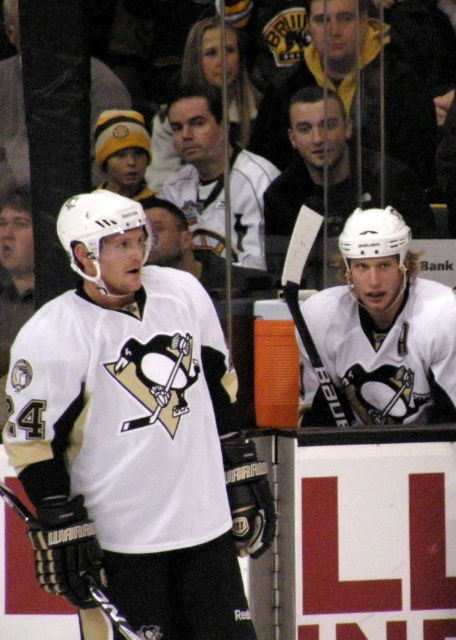
Which is behind, point (128, 180) or point (286, 301)?

Point (128, 180)

What are the coordinates of `matte black helmet at upper left` in the screenshot? It's located at (123, 150).

Is white matte helmet at upper center behind matte black helmet at upper left?

No.

Who is positioned more to the left, white matte helmet at upper center or matte black helmet at upper left?

matte black helmet at upper left is more to the left.

Who is more forward, (393, 259) or (96, 147)?

Point (393, 259) is in front.

Where is `white matte helmet at upper center`? The width and height of the screenshot is (456, 640). white matte helmet at upper center is located at coordinates (373, 323).

Between white matte jersey at left and matte black helmet at upper left, which one appears on the left side from the viewer's perspective?

matte black helmet at upper left

Between white matte jersey at left and matte black helmet at upper left, which one appears on the right side from the viewer's perspective?

white matte jersey at left

Where is `white matte jersey at left`? Image resolution: width=456 pixels, height=640 pixels. white matte jersey at left is located at coordinates (134, 436).